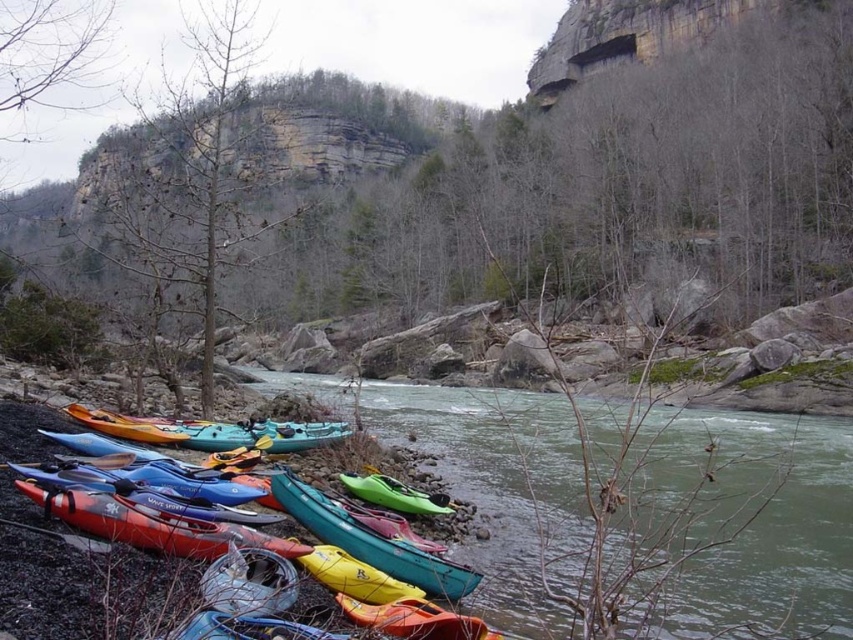
Does point (616, 436) come farther from viewer compared to point (384, 481)?

Yes, point (616, 436) is farther from viewer.

Can you confirm if green plastic kayaks at lower left is bigger than green matte kayak at lower center?

Yes, green plastic kayaks at lower left is bigger than green matte kayak at lower center.

Is point (482, 404) positioned after point (447, 502)?

Yes, it is behind point (447, 502).

You are a GUI agent. You are given a task and a screenshot of the screen. Output one action in this format:
    pyautogui.click(x=<x>, y=<y>)
    Task: Click on the green plastic kayaks at lower left
    
    Given the screenshot: What is the action you would take?
    pyautogui.click(x=747, y=524)

Is point (602, 476) behind point (126, 452)?

Yes, point (602, 476) is behind point (126, 452).

Can you confirm if green plastic kayaks at lower left is positioned below blue plastic paddle at lower left?

Yes.

This screenshot has height=640, width=853. Identify the location of green plastic kayaks at lower left. (747, 524).

Measure the distance from blue plastic paddle at lower left to green matte kayak at lower center.

11.38 meters

Can you confirm if blue plastic paddle at lower left is positioned to the right of green matte kayak at lower center?

No, blue plastic paddle at lower left is not to the right of green matte kayak at lower center.

The width and height of the screenshot is (853, 640). I want to click on blue plastic paddle at lower left, so click(105, 460).